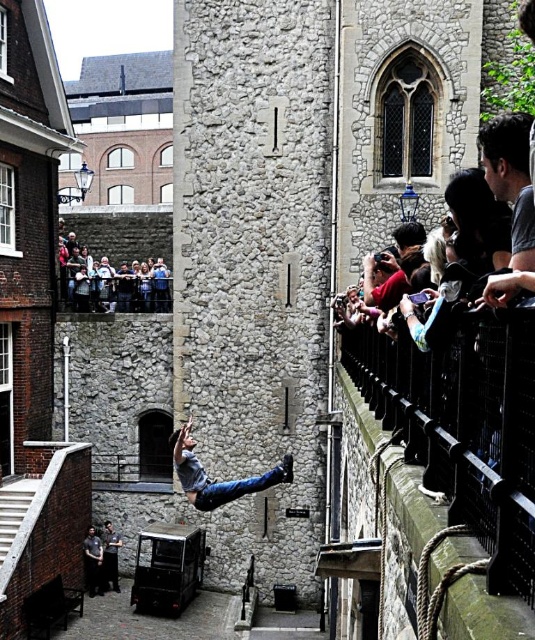
You are standing at the point marked by the coordinates point (124, 234) in the historic stone building. Looking around, what is the most prominent feature directly in front of you?

A: The point (124, 234) marks the matte gray stone crowd at upper left, so the most prominent feature directly in front of you would be the large arched window with intricate tracery on one side of the historic stone building.

You are standing in the historic stone building and want to move from point A to point B. Point A is at coordinates point (164,230) and point B is at coordinates point (110,584). Which point is closer to you?

Point (164,230) is closer to you because it is further to the viewer than point (110,584).